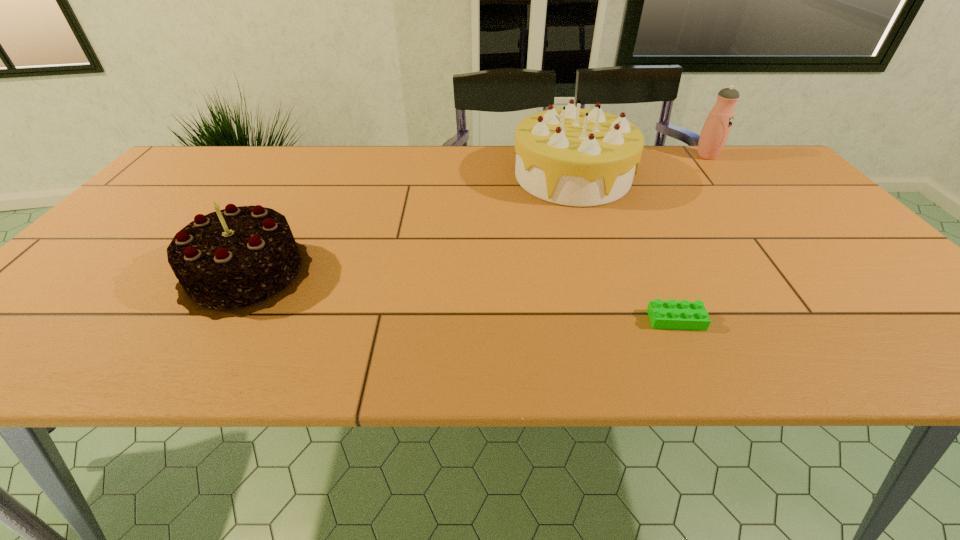
The width and height of the screenshot is (960, 540). I want to click on free space between the farther birthday cake and the leftmost object, so click(409, 225).

You are a GUI agent. You are given a task and a screenshot of the screen. Output one action in this format:
    pyautogui.click(x=<x>, y=<y>)
    Task: Click on the free point between the right birthday cake and the nearer birthday cake
    The image size is (960, 540).
    Given the screenshot: What is the action you would take?
    [409, 225]

This screenshot has width=960, height=540. Find the location of `free space between the thermos bottle and the nearer birthday cake`. free space between the thermos bottle and the nearer birthday cake is located at coordinates (476, 214).

Where is `vacant space that's between the farther birthday cake and the thermos bottle`? vacant space that's between the farther birthday cake and the thermos bottle is located at coordinates (639, 166).

I want to click on vacant area that lies between the leftmost object and the rightmost object, so click(476, 214).

The width and height of the screenshot is (960, 540). Find the location of `vacant area that lies between the Lego and the farther birthday cake`. vacant area that lies between the Lego and the farther birthday cake is located at coordinates (624, 248).

At what (x,y) coordinates should I click in order to perform the action: click on free spot between the farther birthday cake and the nearer birthday cake. Please return your answer as a coordinate pair (x, y). This screenshot has width=960, height=540. Looking at the image, I should click on (409, 225).

The height and width of the screenshot is (540, 960). Identify the location of vacant space in between the leftmost object and the Lego. [x=461, y=296].

Where is `empty space that is in between the farther birthday cake and the nearer birthday cake`? empty space that is in between the farther birthday cake and the nearer birthday cake is located at coordinates (409, 225).

I want to click on object that stands as the second closest to the farther birthday cake, so click(x=681, y=315).